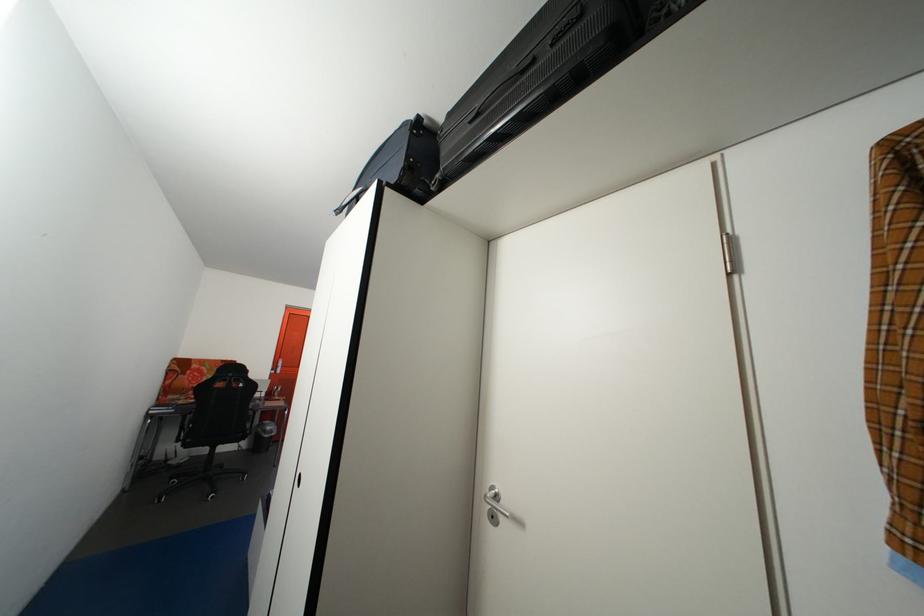
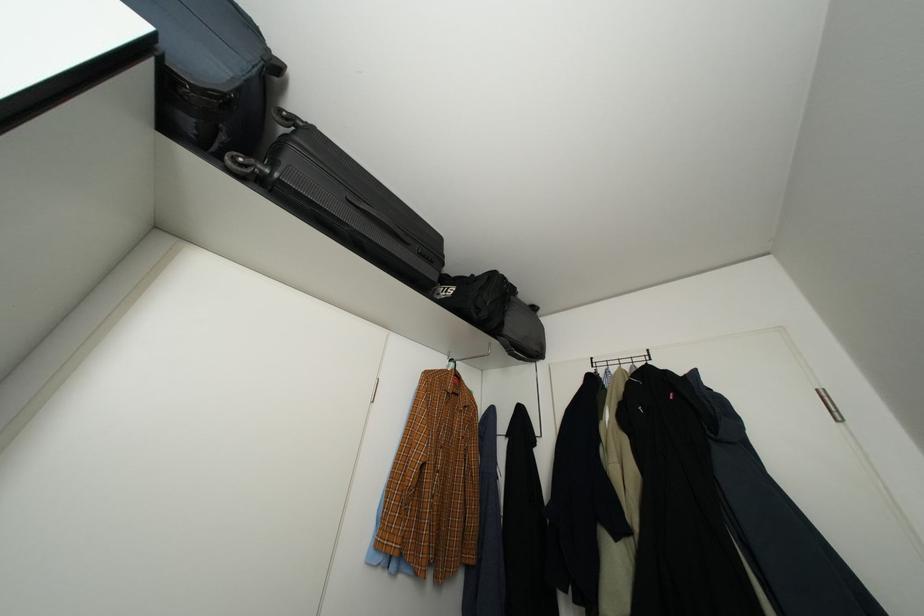
Locate, in the second image, the point that corresponds to point (460, 121) in the first image.

(323, 135)